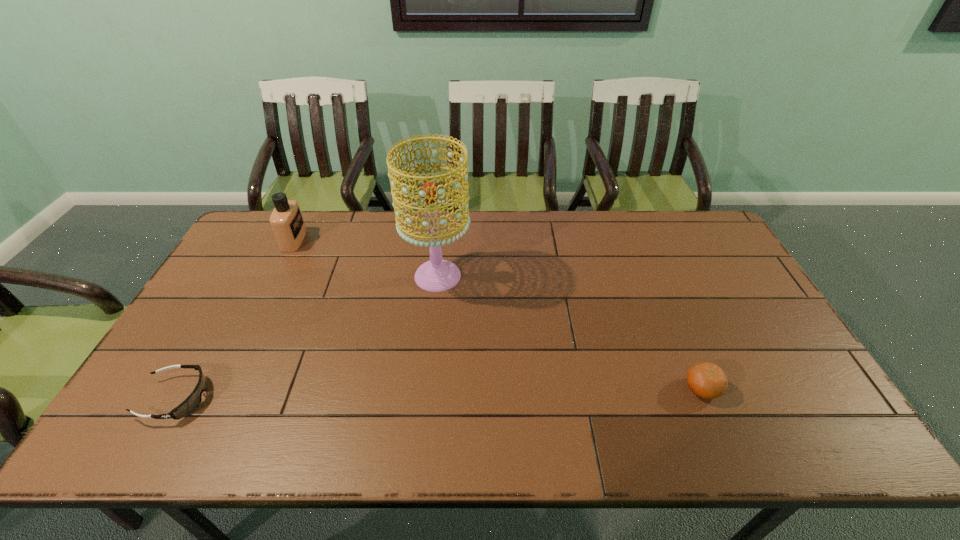
At what (x,y) coordinates should I click in order to perform the action: click on free space located on the front and sides of the goggles. Please return your answer as a coordinate pair (x, y). Image resolution: width=960 pixels, height=540 pixels. Looking at the image, I should click on (240, 398).

Identify the location of object located in the far edge section of the desktop. The image size is (960, 540). [x=286, y=220].

Find the location of `object situated at the near edge`. object situated at the near edge is located at coordinates (194, 399).

Image resolution: width=960 pixels, height=540 pixels. I want to click on perfume that is at the left edge, so click(286, 220).

Where is `goggles located at the left edge`? The width and height of the screenshot is (960, 540). goggles located at the left edge is located at coordinates (194, 399).

Find the location of a particular element. The image size is (960, 540). object located at the far left corner is located at coordinates (286, 220).

This screenshot has width=960, height=540. Find the location of `object located in the near left corner section of the desktop`. object located in the near left corner section of the desktop is located at coordinates (194, 399).

Image resolution: width=960 pixels, height=540 pixels. In the image, there is a desktop. Find the location of `vacant region at the far edge`. vacant region at the far edge is located at coordinates (511, 246).

The height and width of the screenshot is (540, 960). In order to click on blank area at the near edge in this screenshot , I will do `click(713, 423)`.

Find the location of a particular element. Image resolution: width=960 pixels, height=540 pixels. free space at the left edge of the desktop is located at coordinates (223, 268).